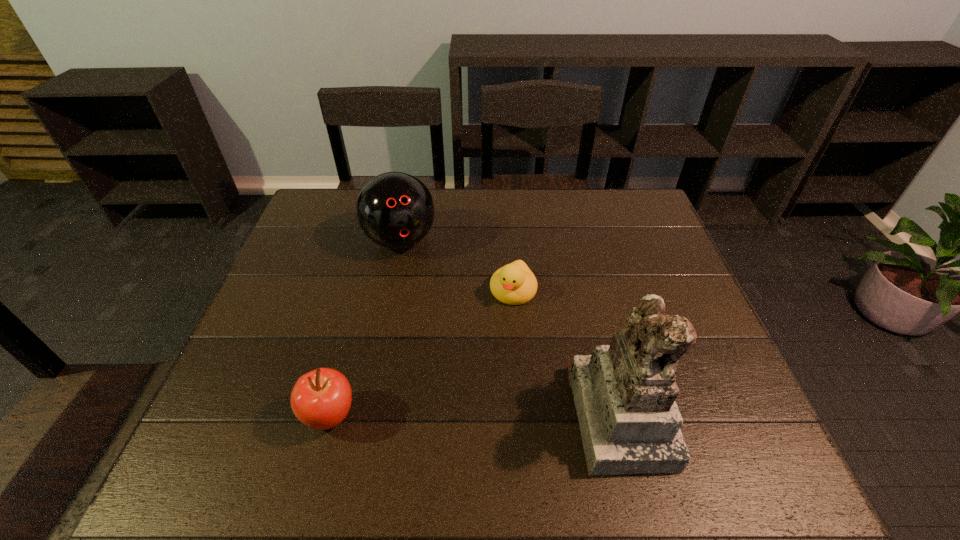
Where is `the second shortest object`? The image size is (960, 540). the second shortest object is located at coordinates (321, 399).

You are a GUI agent. You are given a task and a screenshot of the screen. Output one action in this format:
    pyautogui.click(x=<x>, y=<y>)
    Task: Click on the figurine
    Image resolution: width=960 pixels, height=540 pixels.
    Given the screenshot: What is the action you would take?
    pyautogui.click(x=624, y=393)

Where is `the rightmost object`? the rightmost object is located at coordinates (624, 393).

This screenshot has width=960, height=540. Find the location of `the second object from right to left`. the second object from right to left is located at coordinates (514, 284).

Image resolution: width=960 pixels, height=540 pixels. I want to click on the shortest object, so click(514, 284).

At what (x,y) coordinates should I click in order to perform the action: click on the third shortest object. Please return your answer as a coordinate pair (x, y). The height and width of the screenshot is (540, 960). Looking at the image, I should click on (395, 210).

Find the location of a particular element. This screenshot has height=540, width=960. bowling ball is located at coordinates click(x=395, y=210).

You are a GUI agent. You are given a task and a screenshot of the screen. Output one action in this format:
    pyautogui.click(x=<x>, y=<y>)
    Task: Click on the vacant space situated on the right of the second shortest object
    Image resolution: width=960 pixels, height=540 pixels.
    Given the screenshot: What is the action you would take?
    pyautogui.click(x=520, y=416)

The height and width of the screenshot is (540, 960). What are the coordinates of `vacant point located on the front-facing side of the rightmost object` in the screenshot? It's located at (736, 414).

Where is `free space located 0.230m on the face of the third nearest object`? The height and width of the screenshot is (540, 960). free space located 0.230m on the face of the third nearest object is located at coordinates (476, 380).